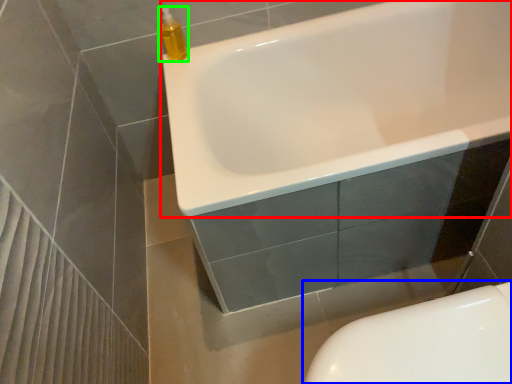
Question: Based on their relative distances, which object is farther from bathtub (highlighted by a red box)? Choose from toilet (highlighted by a blue box) and cleaning product (highlighted by a green box).

Choices:
 (A) toilet
 (B) cleaning product

Answer: (A)